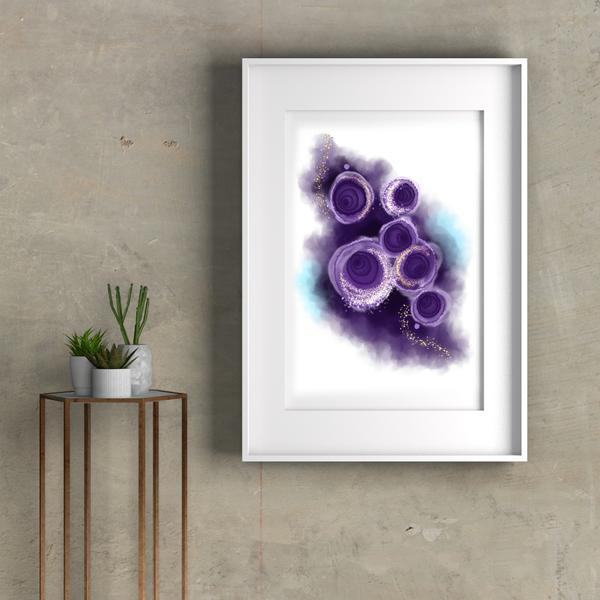
Locate an element on the screen. This screenshot has width=600, height=600. picture frame is located at coordinates (524, 105).